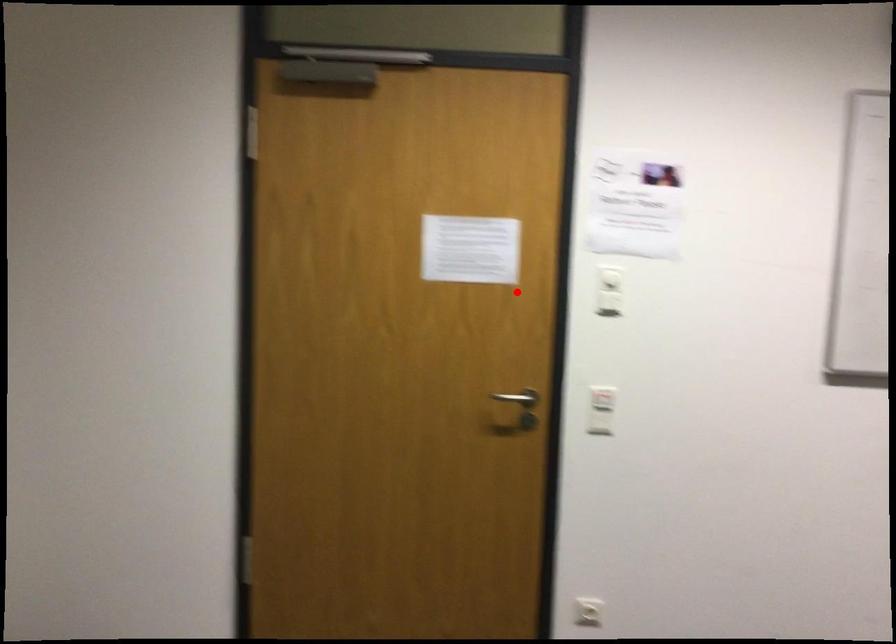
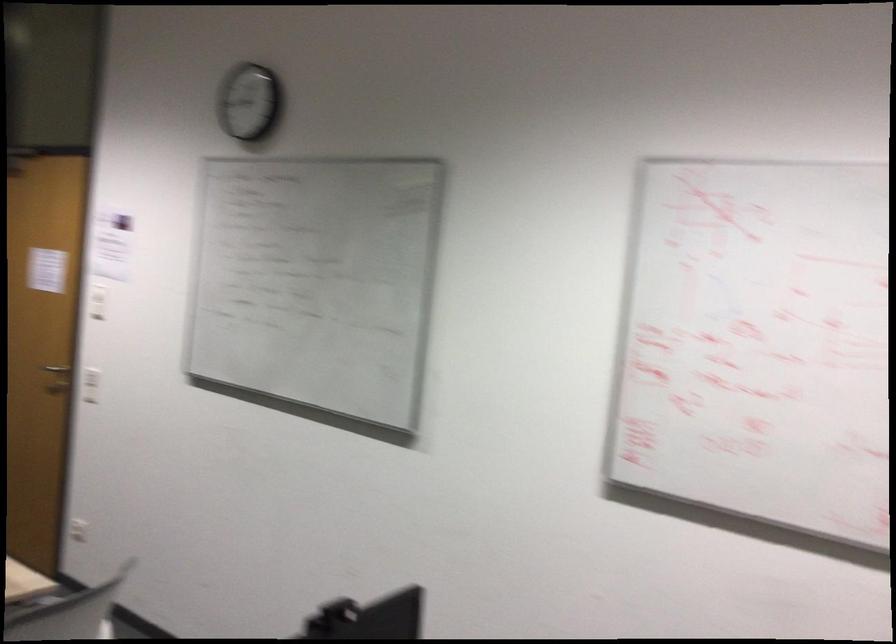
Question: I am providing you with two images of the same scene from different viewpoints. A red point is shown in image1. For the corresponding object point in image2, is it positioned nearer or farther from the camera?

Choices:
 (A) Nearer
 (B) Farther

Answer: (B)